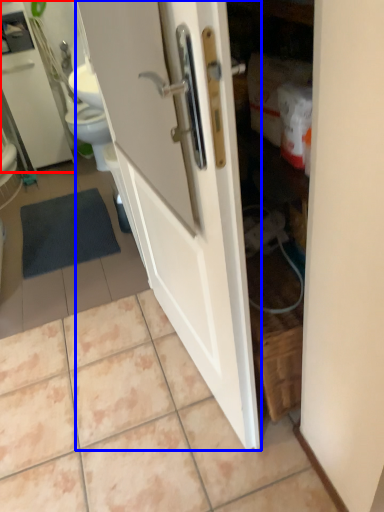
Question: Among these objects, which one is farthest to the camera, medicine cabinet (highlighted by a red box) or door (highlighted by a blue box)?

Choices:
 (A) medicine cabinet
 (B) door

Answer: (A)